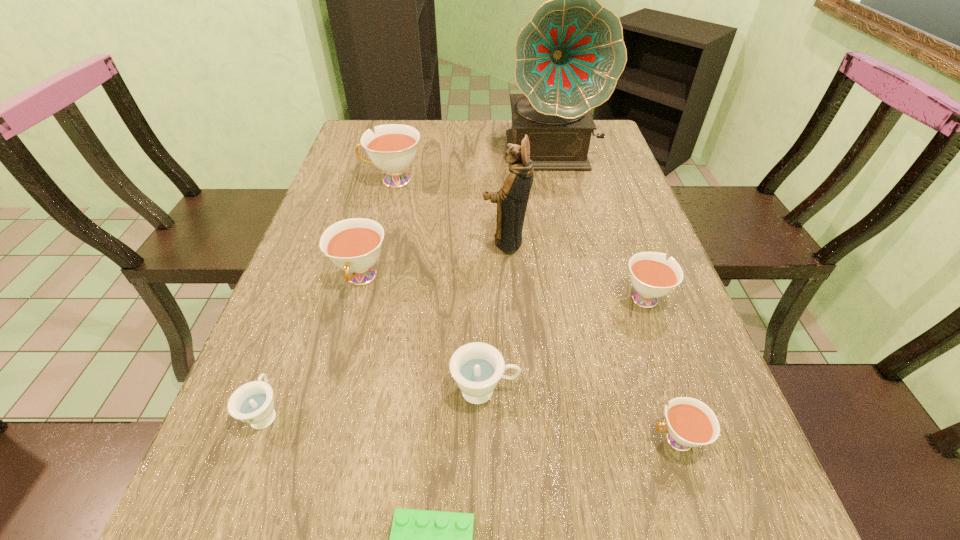
Identify the location of vacant space located on the side of the third biggest white teacup with the handle. This screenshot has width=960, height=540. 612,206.

Where is `free space located on the side of the third biggest white teacup with the handle`? The width and height of the screenshot is (960, 540). free space located on the side of the third biggest white teacup with the handle is located at coordinates [x=618, y=224].

Where is `vacant point located 0.200m on the side of the bigger blue teacup with the handle`? This screenshot has height=540, width=960. vacant point located 0.200m on the side of the bigger blue teacup with the handle is located at coordinates (632, 390).

Image resolution: width=960 pixels, height=540 pixels. Identify the location of free region located on the side of the nearest white teacup with the handle. click(538, 440).

Where is `vacant space situated 0.350m on the side of the nearest white teacup with the handle`? The image size is (960, 540). vacant space situated 0.350m on the side of the nearest white teacup with the handle is located at coordinates (434, 440).

At what (x,y) coordinates should I click in order to perform the action: click on vacant space situated on the side of the nearest white teacup with the handle. Please return your answer as a coordinate pair (x, y). The width and height of the screenshot is (960, 540). Looking at the image, I should click on (490, 440).

This screenshot has height=540, width=960. Find the location of `vacant area situated 0.320m on the side of the smaller blue teacup with the handle`. vacant area situated 0.320m on the side of the smaller blue teacup with the handle is located at coordinates tap(320, 266).

The height and width of the screenshot is (540, 960). What are the coordinates of `vacant point located on the side of the smaller blue teacup with the handle` in the screenshot? It's located at coord(305,305).

Where is `free location located on the side of the smaller blue teacup with the handle`? This screenshot has width=960, height=540. free location located on the side of the smaller blue teacup with the handle is located at coordinates (283, 366).

Where is `object positioned at the far edge`? The width and height of the screenshot is (960, 540). object positioned at the far edge is located at coordinates (569, 56).